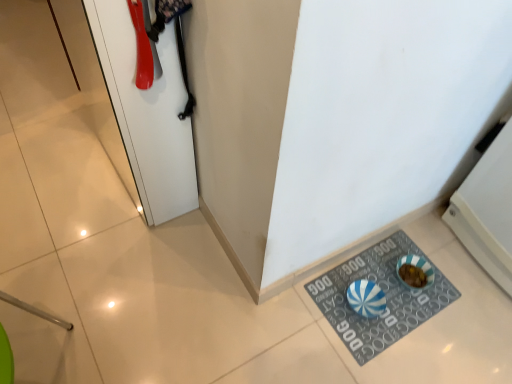
Question: Considering the relative sizes of blue and white striped rubber mat at lower right and white glossy door at upper left in the image provided, is blue and white striped rubber mat at lower right shorter than white glossy door at upper left?

Choices:
 (A) yes
 (B) no

Answer: (A)

Question: From a real-world perspective, is blue and white striped rubber mat at lower right positioned under white glossy door at upper left based on gravity?

Choices:
 (A) no
 (B) yes

Answer: (B)

Question: Is blue and white striped rubber mat at lower right taller than white glossy door at upper left?

Choices:
 (A) no
 (B) yes

Answer: (A)

Question: Considering the relative sizes of blue and white striped rubber mat at lower right and white glossy door at upper left in the image provided, is blue and white striped rubber mat at lower right wider than white glossy door at upper left?

Choices:
 (A) yes
 (B) no

Answer: (A)

Question: Does blue and white striped rubber mat at lower right turn towards white glossy door at upper left?

Choices:
 (A) no
 (B) yes

Answer: (A)

Question: Does blue and white striped rubber mat at lower right have a smaller size compared to white glossy door at upper left?

Choices:
 (A) no
 (B) yes

Answer: (B)

Question: Can blue and white striped rubber mat at lower right be found inside white glossy door at upper left?

Choices:
 (A) no
 (B) yes

Answer: (A)

Question: Considering the relative sizes of white glossy door at upper left and blue and white striped rubber mat at lower right in the image provided, is white glossy door at upper left wider than blue and white striped rubber mat at lower right?

Choices:
 (A) no
 (B) yes

Answer: (A)

Question: Considering the relative sizes of white glossy door at upper left and blue and white striped rubber mat at lower right in the image provided, is white glossy door at upper left shorter than blue and white striped rubber mat at lower right?

Choices:
 (A) yes
 (B) no

Answer: (B)

Question: Does white glossy door at upper left turn towards blue and white striped rubber mat at lower right?

Choices:
 (A) yes
 (B) no

Answer: (B)

Question: From a real-world perspective, is white glossy door at upper left under blue and white striped rubber mat at lower right?

Choices:
 (A) no
 (B) yes

Answer: (A)

Question: Does white glossy door at upper left have a lesser width compared to blue and white striped rubber mat at lower right?

Choices:
 (A) no
 (B) yes

Answer: (B)

Question: Considering the positions of point (388, 238) and point (175, 150), is point (388, 238) closer or farther from the camera than point (175, 150)?

Choices:
 (A) farther
 (B) closer

Answer: (A)